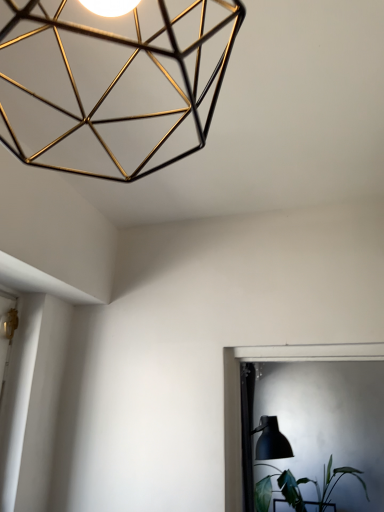
Locate an element on the screen. This screenshot has width=384, height=512. gold wireframe lamp at upper left is located at coordinates (112, 83).

The width and height of the screenshot is (384, 512). Find the location of `matte black table lamp at lower right`. matte black table lamp at lower right is located at coordinates (271, 440).

At what (x,y) coordinates should I click in order to perform the action: click on gold wireframe lamp at upper left. Please return your answer as a coordinate pair (x, y). The image size is (384, 512). Looking at the image, I should click on (112, 83).

From the image's perspective, is gold wireframe lamp at upper left below green leafy plant at lower right?

No, from the image's perspective, gold wireframe lamp at upper left is not below green leafy plant at lower right.

Which is farther, (12, 104) or (261, 511)?

Positioned behind is point (261, 511).

Considering the relative positions of gold wireframe lamp at upper left and green leafy plant at lower right in the image provided, is gold wireframe lamp at upper left to the right of green leafy plant at lower right from the viewer's perspective?

No.

Does gold wireframe lamp at upper left turn towards green leafy plant at lower right?

Yes.

Is matte black table lamp at lower right taller than green leafy plant at lower right?

Yes.

Would you say matte black table lamp at lower right is inside or outside green leafy plant at lower right?

The correct answer is: outside.

Can you tell me how much matte black table lamp at lower right and green leafy plant at lower right differ in facing direction?

The facing directions of matte black table lamp at lower right and green leafy plant at lower right are 49.9 degrees apart.

From a real-world perspective, between green leafy plant at lower right and matte black table lamp at lower right, who is vertically higher?

From a 3D spatial view, matte black table lamp at lower right is above.

In the scene shown: Which of these two, green leafy plant at lower right or matte black table lamp at lower right, stands shorter?

With less height is green leafy plant at lower right.

Looking at this image, is green leafy plant at lower right to the left or to the right of matte black table lamp at lower right in the image?

Based on their positions, green leafy plant at lower right is located to the right of matte black table lamp at lower right.

Considering the sizes of objects gold wireframe lamp at upper left and matte black table lamp at lower right in the image provided, who is thinner, gold wireframe lamp at upper left or matte black table lamp at lower right?

With smaller width is gold wireframe lamp at upper left.

This screenshot has width=384, height=512. I want to click on table lamp that is behind the gold wireframe lamp at upper left, so click(271, 440).

Would you say matte black table lamp at lower right is part of gold wireframe lamp at upper left's contents?

No, matte black table lamp at lower right is not a part of gold wireframe lamp at upper left.

Considering the sizes of gold wireframe lamp at upper left and matte black table lamp at lower right in the image, is gold wireframe lamp at upper left taller or shorter than matte black table lamp at lower right?

Considering their sizes, gold wireframe lamp at upper left has less height than matte black table lamp at lower right.

From a real-world perspective, is matte black table lamp at lower right located higher than gold wireframe lamp at upper left?

A: Actually, matte black table lamp at lower right is physically below gold wireframe lamp at upper left in the real world.

In order to click on lamp above the matte black table lamp at lower right (from a real-world perspective) in this screenshot , I will do `click(112, 83)`.

Choose the correct answer: Is matte black table lamp at lower right inside gold wireframe lamp at upper left or outside it?

matte black table lamp at lower right is outside gold wireframe lamp at upper left.

Is green leafy plant at lower right next to gold wireframe lamp at upper left?

No, green leafy plant at lower right is not next to gold wireframe lamp at upper left.

Does green leafy plant at lower right have a larger size compared to gold wireframe lamp at upper left?

Correct, green leafy plant at lower right is larger in size than gold wireframe lamp at upper left.

Which object is closer to the camera, green leafy plant at lower right or gold wireframe lamp at upper left?

gold wireframe lamp at upper left is closer to the camera.

Is point (271, 494) less distant than point (206, 138)?

No, (271, 494) is further to viewer.

Locate an element on the screen. Image resolution: width=384 pixels, height=512 pixels. lamp above the green leafy plant at lower right (from the image's perspective) is located at coordinates (112, 83).

Identify the location of table lamp in front of the green leafy plant at lower right. Image resolution: width=384 pixels, height=512 pixels. (271, 440).

Considering their positions, is green leafy plant at lower right positioned further to gold wireframe lamp at upper left than matte black table lamp at lower right?

Among the two, green leafy plant at lower right is located further to gold wireframe lamp at upper left.

Estimate the real-world distances between objects in this image. Which object is closer to gold wireframe lamp at upper left, matte black table lamp at lower right or green leafy plant at lower right?

matte black table lamp at lower right is closer to gold wireframe lamp at upper left.

Which object lies nearer to the anchor point matte black table lamp at lower right, green leafy plant at lower right or gold wireframe lamp at upper left?

green leafy plant at lower right is closer to matte black table lamp at lower right.

Consider the image. When comparing their distances from green leafy plant at lower right, does gold wireframe lamp at upper left or matte black table lamp at lower right seem further?

Among the two, gold wireframe lamp at upper left is located further to green leafy plant at lower right.

Consider the image. Looking at the image, which one is located further to green leafy plant at lower right, matte black table lamp at lower right or gold wireframe lamp at upper left?

The object further to green leafy plant at lower right is gold wireframe lamp at upper left.

Considering their positions, is gold wireframe lamp at upper left positioned closer to matte black table lamp at lower right than green leafy plant at lower right?

green leafy plant at lower right is closer to matte black table lamp at lower right.

You are a GUI agent. You are given a task and a screenshot of the screen. Output one action in this format:
    pyautogui.click(x=<x>, y=<y>)
    Task: Click on the table lamp between gold wireframe lamp at upper left and green leafy plant at lower right in the front-back direction
    
    Given the screenshot: What is the action you would take?
    pyautogui.click(x=271, y=440)